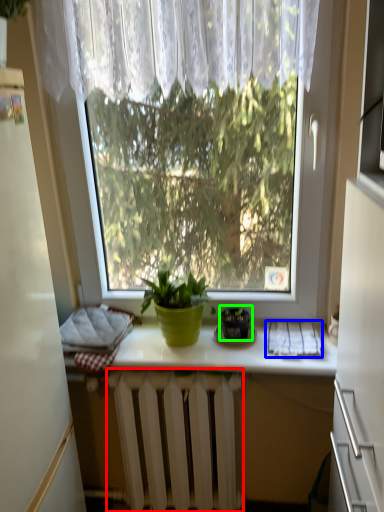
Question: Estimate the real-world distances between objects in this image. Which object is farther from radiator (highlighted by a red box), cloth (highlighted by a blue box) or houseplant (highlighted by a green box)?

Choices:
 (A) cloth
 (B) houseplant

Answer: (A)